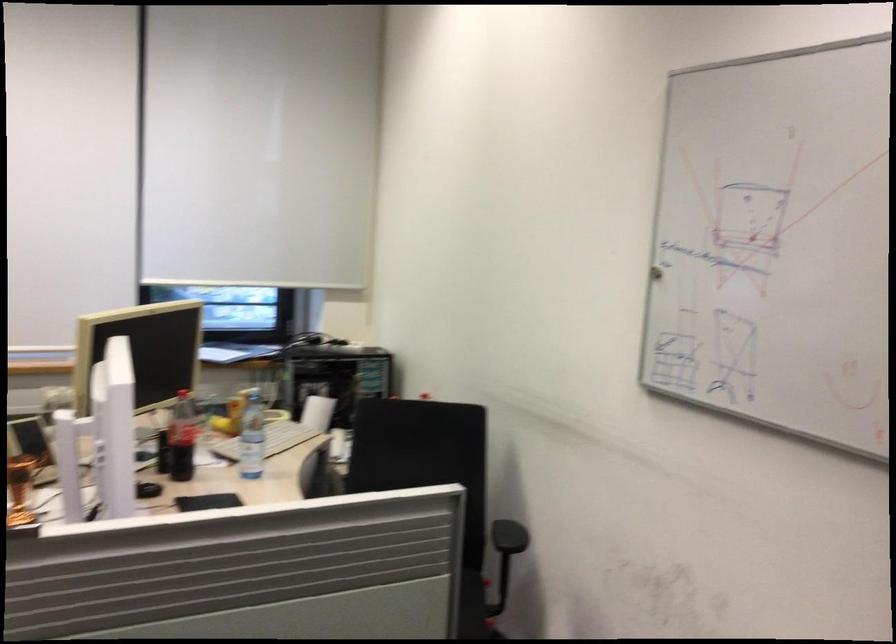
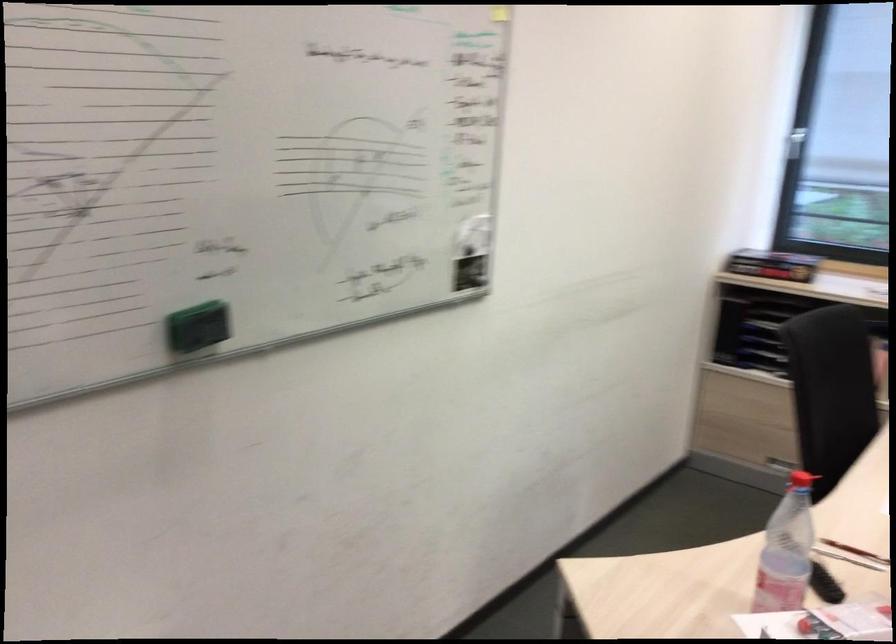
Question: The camera is either moving clockwise (left) or counter-clockwise (right) around the object. The first image is from the beginning of the video and the second image is from the end. Is the camera moving left or right when shooting the video?

Choices:
 (A) Left
 (B) Right

Answer: (B)